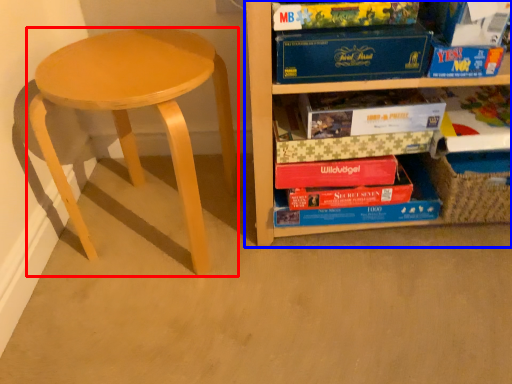
Question: Which point is further to the camera, stool (highlighted by a red box) or shelf (highlighted by a blue box)?

Choices:
 (A) stool
 (B) shelf

Answer: (A)